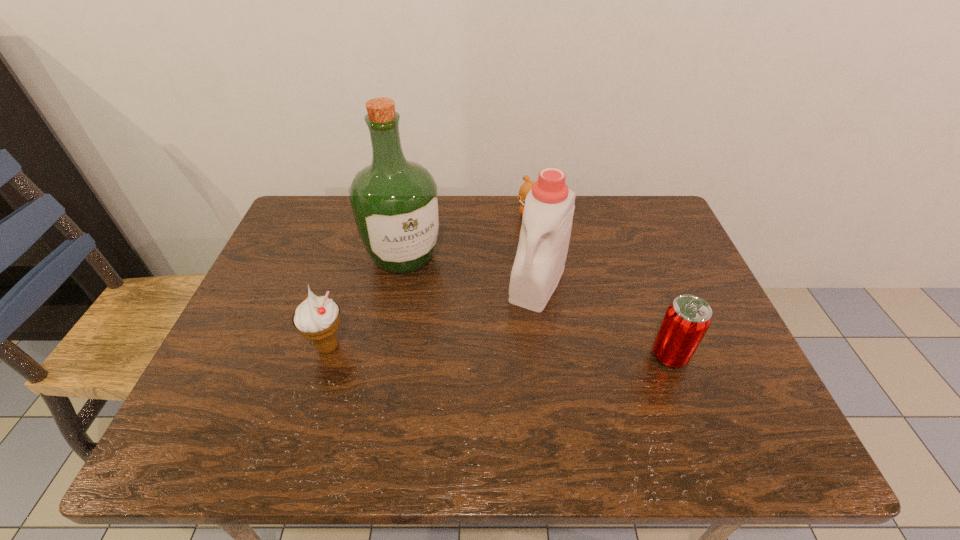
Image resolution: width=960 pixels, height=540 pixels. I want to click on free space located 0.280m on the front-facing side of the tallest object, so click(x=467, y=358).

The width and height of the screenshot is (960, 540). I want to click on free space located 0.050m on the face of the teddy bear, so click(x=525, y=232).

Identify the location of vacant space positioned 0.340m on the face of the teddy bear. The image size is (960, 540). (512, 302).

I want to click on free location located 0.320m on the face of the teddy bear, so tap(514, 296).

I want to click on blank space located on the handle side of the second tallest object, so click(x=501, y=362).

The width and height of the screenshot is (960, 540). Find the location of `free region located on the handle side of the second tallest object`. free region located on the handle side of the second tallest object is located at coordinates (519, 327).

I want to click on vacant space located 0.080m on the handle side of the second tallest object, so click(516, 333).

Locate an element on the screen. This screenshot has height=540, width=960. liquor that is at the far edge is located at coordinates (395, 202).

This screenshot has width=960, height=540. I want to click on teddy bear that is positioned at the far edge, so 527,186.

Identify the location of object that is at the right edge. This screenshot has width=960, height=540. (687, 319).